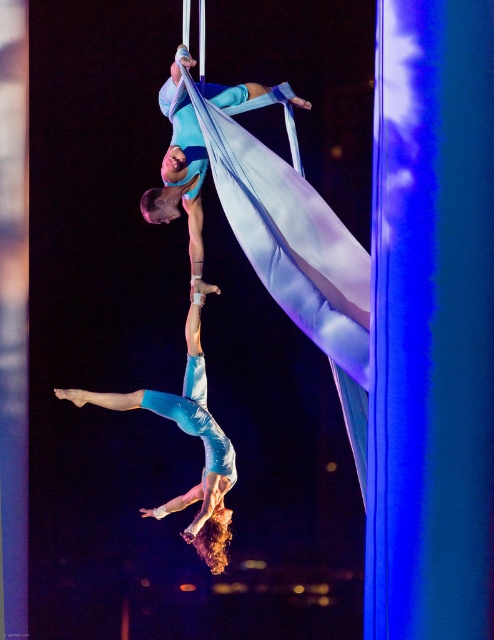
Describe the element at coordinates (189, 433) in the screenshot. This screenshot has height=640, width=494. I see `light blue fabric at center` at that location.

Does light blue fabric at center appear on the right side of matte blue fabric at upper center?

In fact, light blue fabric at center is to the left of matte blue fabric at upper center.

The image size is (494, 640). Find the location of `light blue fabric at center`. light blue fabric at center is located at coordinates (189, 433).